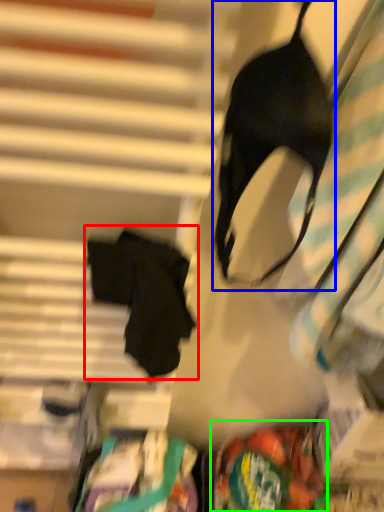
Question: Considering the real-world distances, which object is farthest from robe (highlighted by a red box)? brassiere (highlighted by a blue box) or waste (highlighted by a green box)?

Choices:
 (A) brassiere
 (B) waste

Answer: (B)